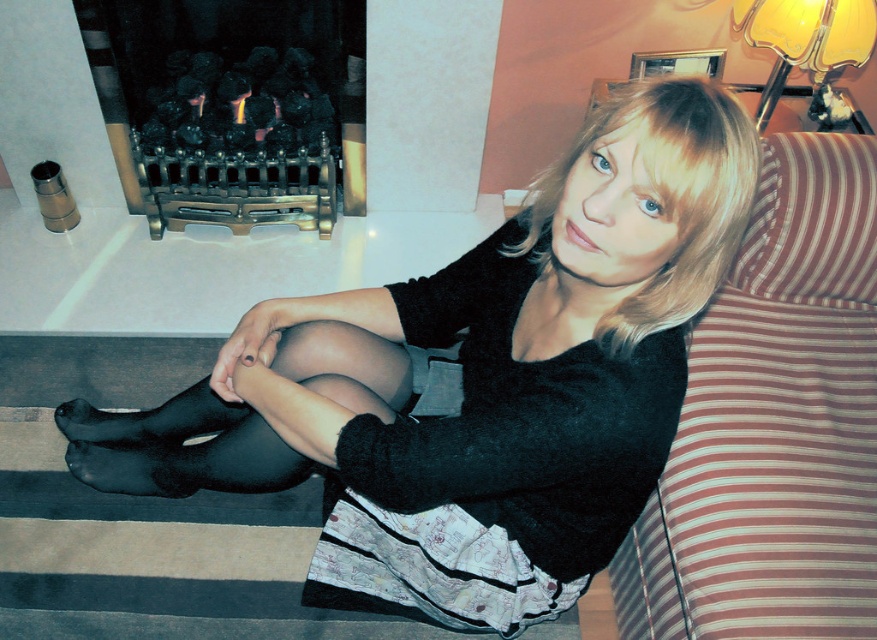
From the picture: Can you confirm if matte black tights at lower left is bigger than striped fabric couch at right?

Yes.

Does point (602, 300) come farther from viewer compared to point (768, 461)?

No, (602, 300) is closer to viewer.

Locate an element on the screen. The width and height of the screenshot is (877, 640). matte black tights at lower left is located at coordinates (478, 374).

Who is lower down, black matte fireplace at upper left or black matte stocking at lower left?

black matte stocking at lower left is lower down.

Locate an element on the screen. The image size is (877, 640). black matte fireplace at upper left is located at coordinates (232, 108).

You are a GUI agent. You are given a task and a screenshot of the screen. Output one action in this format:
    pyautogui.click(x=<x>, y=<y>)
    Task: Click on the black matte fireplace at upper left
    
    Given the screenshot: What is the action you would take?
    pyautogui.click(x=232, y=108)

Who is shorter, striped fabric couch at right or black matte fireplace at upper left?

With less height is black matte fireplace at upper left.

Is point (832, 211) behind point (143, 67)?

That is False.

This screenshot has height=640, width=877. I want to click on striped fabric couch at right, so click(774, 422).